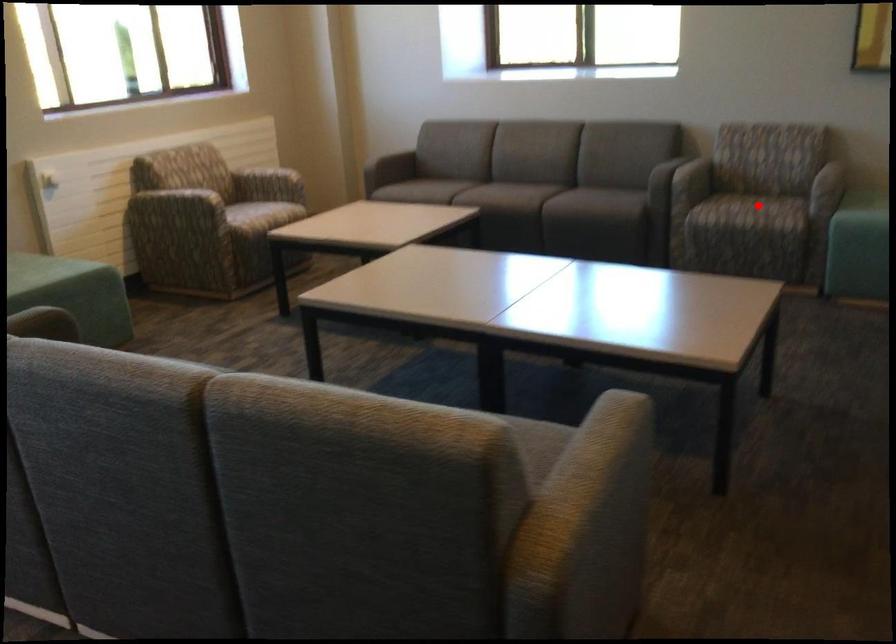
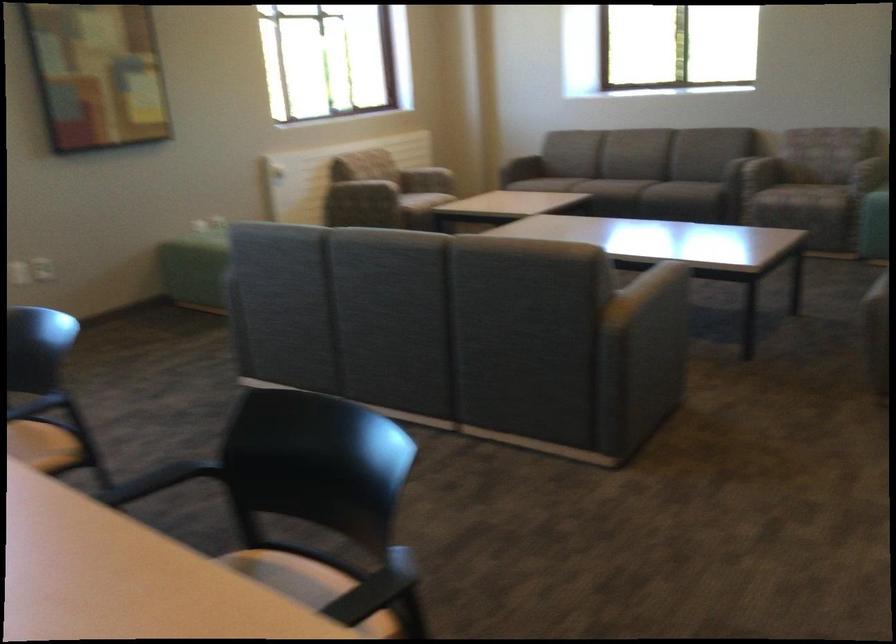
Question: I am providing you with two images of the same scene from different viewpoints. A red point is shown in image1. For the corresponding object point in image2, is it positioned nearer or farther from the camera?

Choices:
 (A) Nearer
 (B) Farther

Answer: (B)